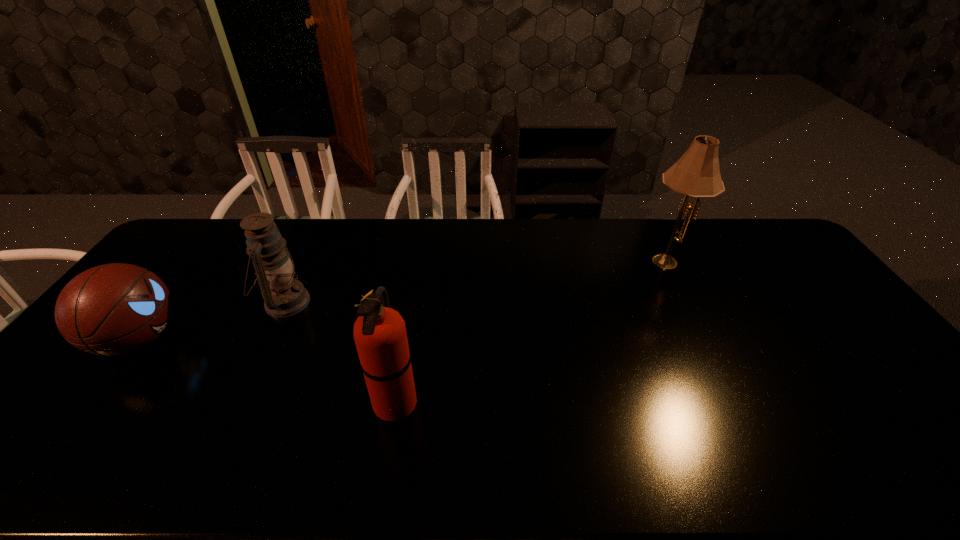
Locate an element on the screen. This screenshot has width=960, height=540. free space between the third object from right to left and the third shortest object is located at coordinates (341, 352).

The width and height of the screenshot is (960, 540). I want to click on free space between the farthest object and the second shortest object, so click(476, 280).

Where is `vacant point located between the oil lamp and the farthest object`? This screenshot has height=540, width=960. vacant point located between the oil lamp and the farthest object is located at coordinates (476, 280).

Identify the location of free area in between the rightmost object and the shortest object. This screenshot has width=960, height=540. (403, 299).

This screenshot has width=960, height=540. What are the coordinates of `vacant space that is in between the farthest object and the basketball` in the screenshot? It's located at (403, 299).

You are a GUI agent. You are given a task and a screenshot of the screen. Output one action in this format:
    pyautogui.click(x=<x>, y=<y>)
    Task: Click on the free space between the lampshade and the fire extinguisher
    The height and width of the screenshot is (540, 960).
    Given the screenshot: What is the action you would take?
    pyautogui.click(x=531, y=330)

Where is `empty location between the oil lamp and the fire extinguisher`? This screenshot has height=540, width=960. empty location between the oil lamp and the fire extinguisher is located at coordinates (341, 352).

This screenshot has height=540, width=960. Identify the location of vacant point located between the oil lamp and the basketball. (212, 320).

Where is `free space between the basketball and the third object from right to left`? free space between the basketball and the third object from right to left is located at coordinates (212, 320).

Choose which object is the third nearest neighbor to the basketball. Please provide its 2D coordinates. Your answer should be formatted as a tuple, i.e. [(x, y)], where the tuple contains the x and y coordinates of a point satisfying the conditions above.

[(697, 174)]